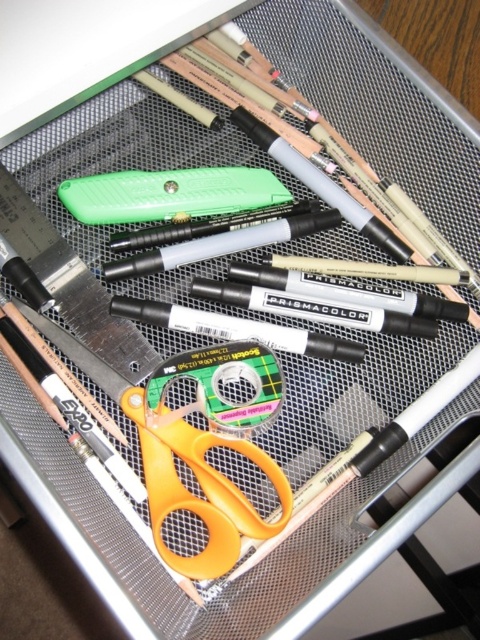
Who is higher up, orange plastic scissors at center or green plastic utility knife at center?

Positioned higher is green plastic utility knife at center.

Does orange plastic scissors at center have a larger size compared to green plastic utility knife at center?

Indeed, orange plastic scissors at center has a larger size compared to green plastic utility knife at center.

Is point (224, 566) farther from viewer compared to point (248, 205)?

No, (224, 566) is in front of (248, 205).

Identify the location of orange plastic scissors at center. The width and height of the screenshot is (480, 640). (202, 490).